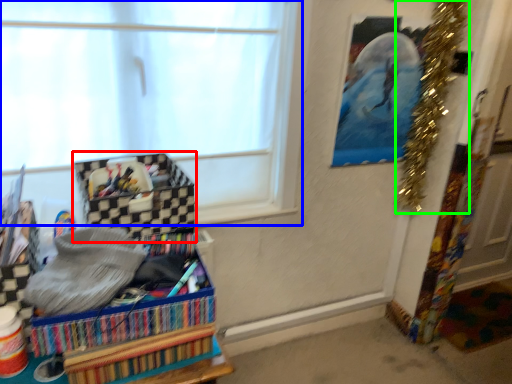
Question: Which object is positioned farthest from storage box (highlighted by a red box)? Select from window (highlighted by a blue box) and christmas decoration (highlighted by a green box).

Choices:
 (A) window
 (B) christmas decoration

Answer: (B)